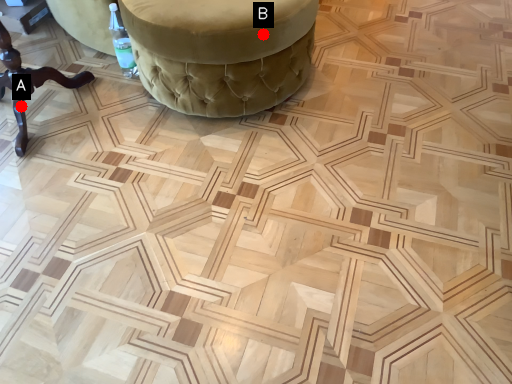
Question: Two points are circled on the image, labeled by A and B beside each circle. Which of the following is the farthest from the observer?

Choices:
 (A) A is further
 (B) B is further

Answer: (A)